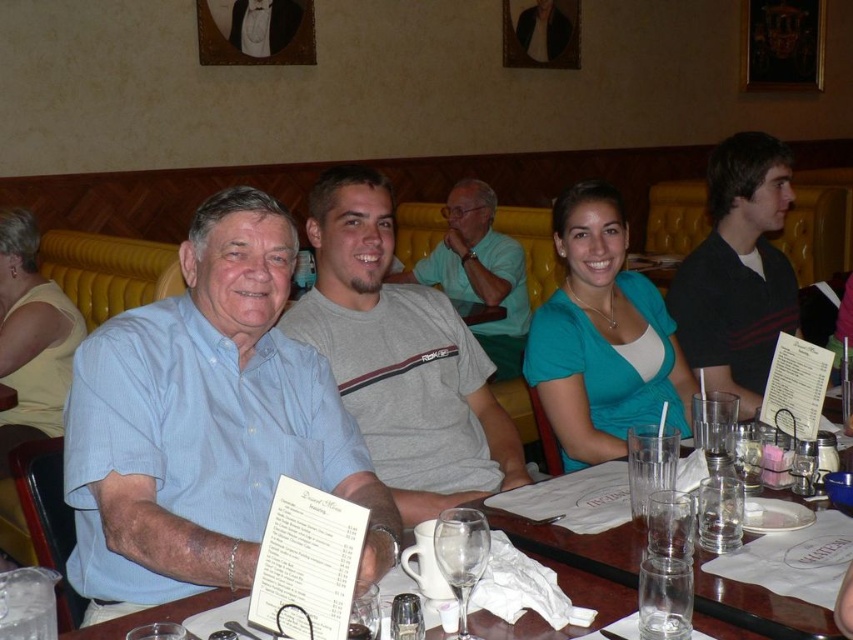
Who is more forward, (339, 474) or (761, 627)?

Point (761, 627) is more forward.

Does light blue shirt at center appear on the right side of clear glassware at center?

In fact, light blue shirt at center is to the left of clear glassware at center.

Locate an element on the screen. light blue shirt at center is located at coordinates (206, 422).

Which is behind, point (387, 531) or point (403, 291)?

Point (403, 291)

Does light blue shirt at center appear under light blue shirt at left?

Correct, light blue shirt at center is located below light blue shirt at left.

Identify the location of light blue shirt at center. (206, 422).

Does light blue shirt at left have a larger size compared to clear glassware at center?

Yes.

Is point (347, 371) behind point (608, 561)?

Yes, it is.

Describe the element at coordinates (399, 356) in the screenshot. I see `light blue shirt at left` at that location.

Find the location of a particular element. light blue shirt at left is located at coordinates (399, 356).